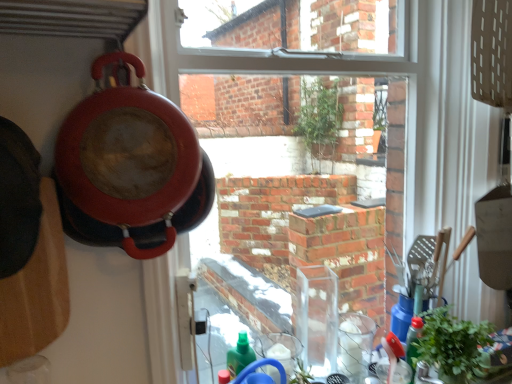
Question: Are matte red pizza pan at left and green leafy plant at lower right making contact?

Choices:
 (A) yes
 (B) no

Answer: (B)

Question: Can you confirm if matte red pizza pan at left is positioned to the right of green leafy plant at lower right?

Choices:
 (A) no
 (B) yes

Answer: (A)

Question: Can you confirm if matte red pizza pan at left is smaller than green leafy plant at lower right?

Choices:
 (A) no
 (B) yes

Answer: (A)

Question: Is matte red pizza pan at left at the left side of green leafy plant at lower right?

Choices:
 (A) no
 (B) yes

Answer: (B)

Question: From the image's perspective, would you say matte red pizza pan at left is shown under green leafy plant at lower right?

Choices:
 (A) yes
 (B) no

Answer: (B)

Question: Is matte red pizza pan at left looking in the opposite direction of green leafy plant at lower right?

Choices:
 (A) yes
 (B) no

Answer: (B)

Question: Is green leafy plant at lower right facing away from matte red pizza pan at left?

Choices:
 (A) no
 (B) yes

Answer: (A)

Question: Does green leafy plant at lower right have a larger size compared to matte red pizza pan at left?

Choices:
 (A) yes
 (B) no

Answer: (B)

Question: Does green leafy plant at lower right have a lesser height compared to matte red pizza pan at left?

Choices:
 (A) no
 (B) yes

Answer: (B)

Question: From the image's perspective, does green leafy plant at lower right appear lower than matte red pizza pan at left?

Choices:
 (A) no
 (B) yes

Answer: (B)

Question: Is green leafy plant at lower right not near matte red pizza pan at left?

Choices:
 (A) no
 (B) yes

Answer: (A)

Question: Considering the relative sizes of green leafy plant at lower right and matte red pizza pan at left in the image provided, is green leafy plant at lower right smaller than matte red pizza pan at left?

Choices:
 (A) no
 (B) yes

Answer: (B)

Question: Considering the positions of matte red pizza pan at left and green leafy plant at lower right in the image, is matte red pizza pan at left taller or shorter than green leafy plant at lower right?

Choices:
 (A) tall
 (B) short

Answer: (A)